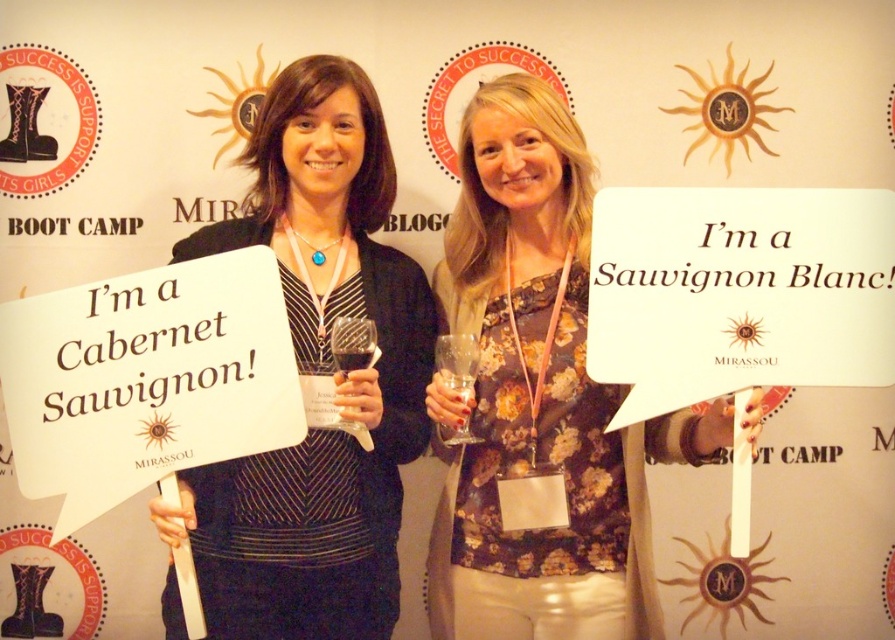
Question: Does matte black dress at center appear on the right side of clear glass wine glass at center?

Choices:
 (A) no
 (B) yes

Answer: (A)

Question: Can you confirm if floral print blouse at center is bigger than matte black dress at center?

Choices:
 (A) no
 (B) yes

Answer: (A)

Question: Which is farther from the matte black dress at center?

Choices:
 (A) clear glass wine glass at center
 (B) floral print blouse at center
 (C) transparent glass wine glass at center

Answer: (A)

Question: Which of the following is the closest to the observer?

Choices:
 (A) (361, 156)
 (B) (440, 344)
 (C) (333, 355)

Answer: (C)

Question: Is matte black dress at center wider than clear glass wine glass at center?

Choices:
 (A) no
 (B) yes

Answer: (B)

Question: Which of the following is the closest to the observer?

Choices:
 (A) (474, 362)
 (B) (465, 324)

Answer: (A)